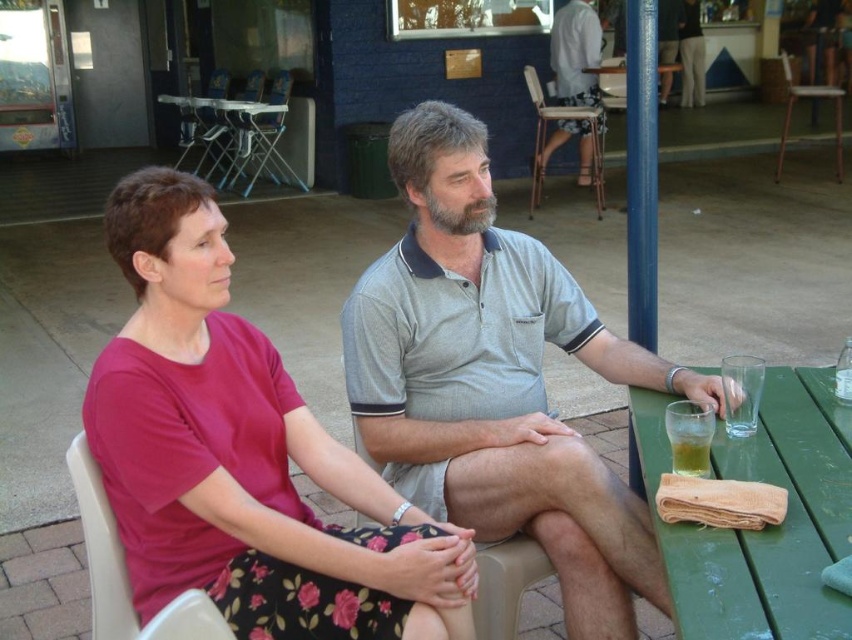
You are a waiter at an outdoor cafe. You need to place a 50 cm long menu between the gray cotton shirt at center and the translucent glass at table right. Can you fit the menu horizontally between them without it overlapping either object?

The distance between the gray cotton shirt at center and the translucent glass at table right is 50.11 centimeters. Since the menu is 50 cm long, it can fit horizontally between them with a small gap of 0.11 centimeters remaining.

You are a photographer trying to capture a candid shot of the two people at the table. You want to ensure that both the gray cotton shirt at center and the gray cotton shirt at upper center are clearly visible in the frame. Which shirt should you focus on first to ensure proper alignment?

The gray cotton shirt at center is positioned on the left side of the gray cotton shirt at upper center. To ensure proper alignment, focus on the gray cotton shirt at upper center first, as it is on the right side and closer to the center of the frame.

Based on the photo, you are standing in a park and see the pink fabric dress at center and the green plastic picnic table at upper left. Which object is nearer to you?

The pink fabric dress at center is closer to the viewer than the green plastic picnic table at upper left.